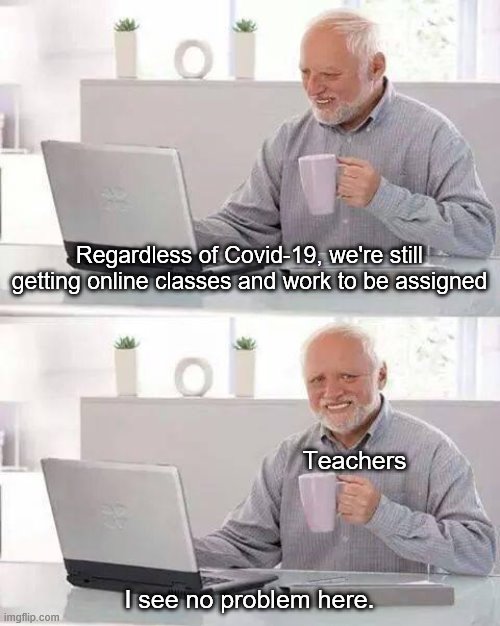
This screenshot has height=626, width=500. I want to click on vases, so click(122, 43), click(244, 53), click(119, 357), click(239, 372).